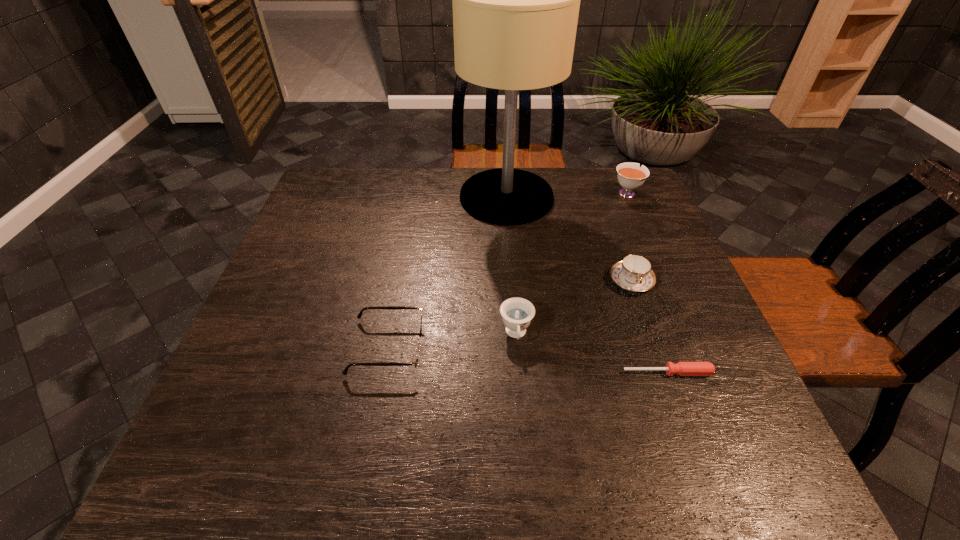
Identify the location of free space that is in between the spectacles and the fourth shortest object. (452, 341).

Locate an element on the screen. vacant region between the second nearest teacup and the nearest teacup is located at coordinates (574, 308).

Image resolution: width=960 pixels, height=540 pixels. Identify the location of unoccupied area between the tallest object and the leftmost teacup. (512, 266).

The height and width of the screenshot is (540, 960). What are the coordinates of `free spot between the tallest object and the second tallest teacup` in the screenshot? It's located at (512, 266).

The image size is (960, 540). I want to click on free space between the leftmost object and the farthest teacup, so click(x=507, y=270).

Image resolution: width=960 pixels, height=540 pixels. What are the coordinates of `object that can be found as the second closest to the shortest object` in the screenshot? It's located at (634, 273).

Select which object appears as the second closest to the leftmost object. Please provide its 2D coordinates. Your answer should be formatted as a tuple, i.e. [(x, y)], where the tuple contains the x and y coordinates of a point satisfying the conditions above.

[(516, 0)]

Point out which teacup is positioned as the second nearest to the screwdriver. Please provide its 2D coordinates. Your answer should be formatted as a tuple, i.e. [(x, y)], where the tuple contains the x and y coordinates of a point satisfying the conditions above.

[(634, 273)]

Choose which teacup is the nearest neighbor to the nearest teacup. Please provide its 2D coordinates. Your answer should be formatted as a tuple, i.e. [(x, y)], where the tuple contains the x and y coordinates of a point satisfying the conditions above.

[(634, 273)]